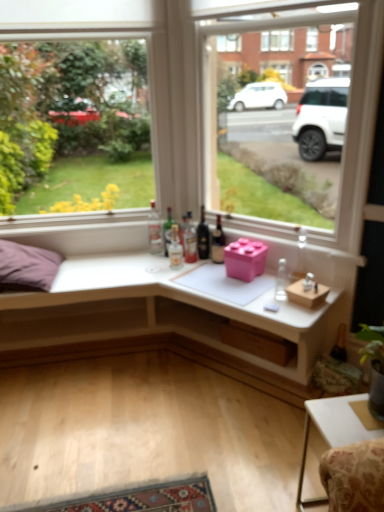
I want to click on vacant space that's between translucent glass bottle at center, acting as the fourth bottle starting from the left, and wooden box at right, the 2th window box in the bottom-to-top sequence, so 237,280.